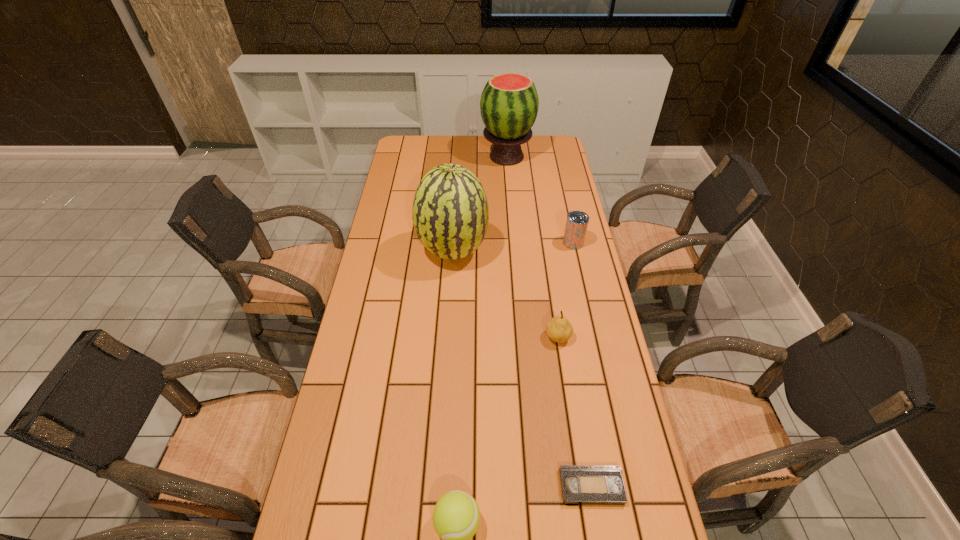
Identify the location of free point at the far right corner. This screenshot has height=540, width=960. (546, 154).

What are the coordinates of `blank region between the shortest object and the nearer watermelon` in the screenshot? It's located at (522, 369).

Identify the location of free point between the beer can and the nearer watermelon. (513, 247).

You are a GUI agent. You are given a task and a screenshot of the screen. Output one action in this format:
    pyautogui.click(x=<x>, y=<y>)
    Task: Click on the free space between the beer can and the pear
    This screenshot has width=960, height=540.
    Given the screenshot: What is the action you would take?
    pyautogui.click(x=565, y=289)

Find the location of a particular element. blank region between the nearer watermelon and the third nearest object is located at coordinates (505, 294).

You are a GUI agent. You are given a task and a screenshot of the screen. Output one action in this format:
    pyautogui.click(x=<x>, y=<y>)
    Task: Click on the vacant region between the beer can and the videotape
    Image resolution: width=960 pixels, height=540 pixels.
    Given the screenshot: What is the action you would take?
    [583, 364]

You are a GUI agent. You are given a task and a screenshot of the screen. Output one action in this format:
    pyautogui.click(x=<x>, y=<y>)
    Task: Click on the free space that is in between the nearer watermelon and the beer can
    The image size is (960, 540).
    Given the screenshot: What is the action you would take?
    pyautogui.click(x=513, y=247)

Point out which object is positioned as the fifth nearest to the beer can. Please provide its 2D coordinates. Your answer should be formatted as a tuple, i.e. [(x, y)], where the tuple contains the x and y coordinates of a point satisfying the conditions above.

[(456, 517)]

What are the coordinates of `the closest object to the farthest object` in the screenshot? It's located at (450, 214).

Find the location of `free space that satisfies the following two spatial constraints: 1. on the front side of the nearer watermelon; 2. on the right side of the shortest object`. free space that satisfies the following two spatial constraints: 1. on the front side of the nearer watermelon; 2. on the right side of the shortest object is located at coordinates pyautogui.click(x=438, y=487).